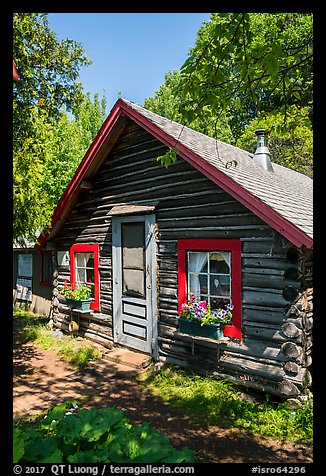
You are a GUI agent. You are given a task and a screenshot of the screen. Output one action in this format:
    pyautogui.click(x=<x>, y=<y>)
    Task: Click on the white curtain
    The height and width of the screenshot is (476, 326).
    Given the screenshot: What is the action you would take?
    pyautogui.click(x=196, y=262), pyautogui.click(x=226, y=259), pyautogui.click(x=79, y=261)